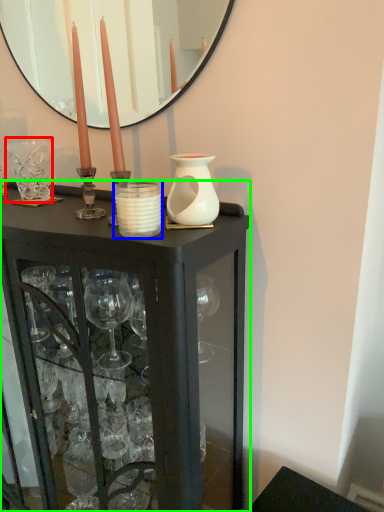
Question: Based on their relative distances, which object is nearer to glass vase (highlighted by a red box)? Choose from candle holder (highlighted by a blue box) and table (highlighted by a green box).

Choices:
 (A) candle holder
 (B) table

Answer: (A)